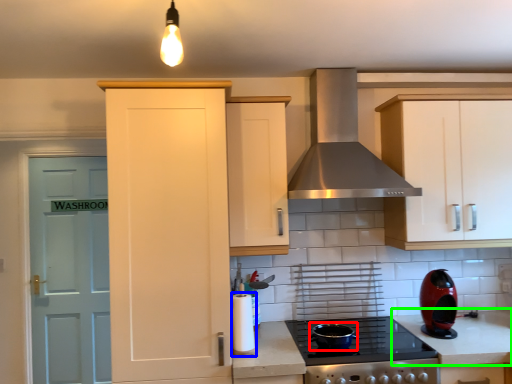
Question: Which is farther away from appliance (highlighted by a red box)? appliance (highlighted by a blue box) or counter top (highlighted by a green box)?

Choices:
 (A) appliance
 (B) counter top

Answer: (B)